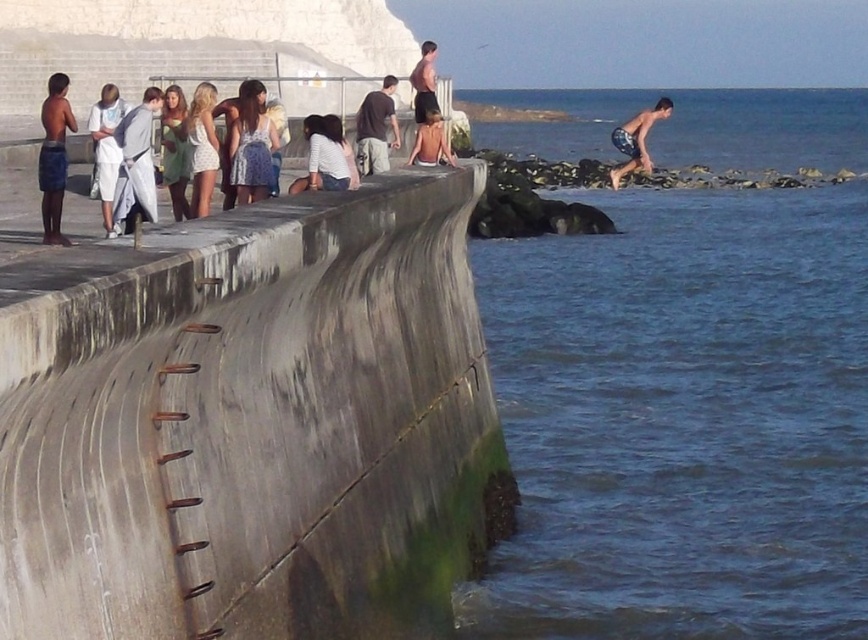
You are a photographer standing at the center of the curved concrete structure. You want to place your camera bag exactly where the light gray fabric coat at left is located. Can you reach that spot without moving past the edge of the structure? Please explain your reasoning.

The light gray fabric coat at left is located at point (136, 164) on the structure. Since the photographer is standing at the center, they can likely reach the coat without moving past the edge, as the coordinates suggest it is within the structure.

You are a photographer positioned at the end of the curved concrete structure. You want to take a photo that includes both the white cotton dress at left and the matte white dress at center. Which dress should you focus on first to ensure both are in frame?

The white cotton dress at left is closer to the viewer than the matte white dress at center, so you should focus on the matte white dress at center first to ensure both are in frame.